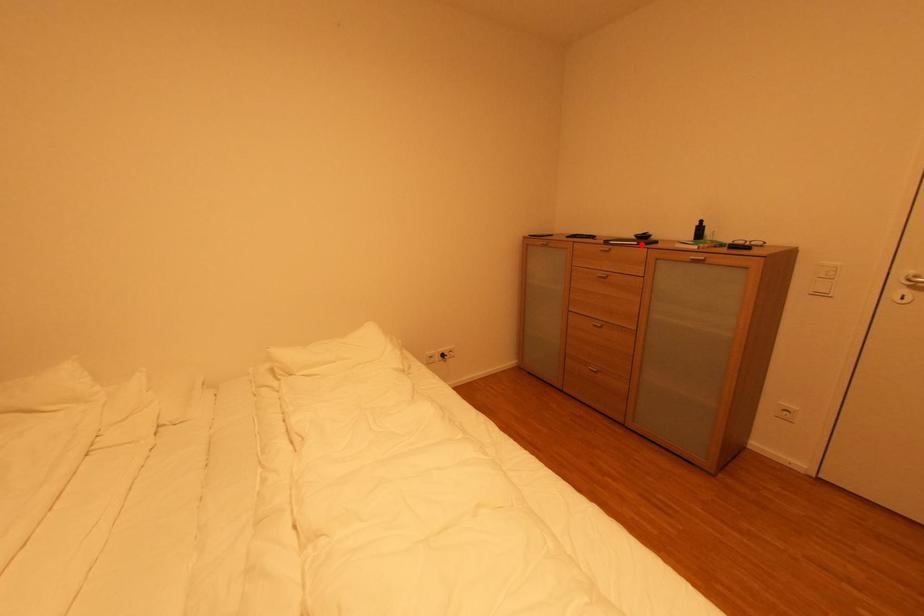
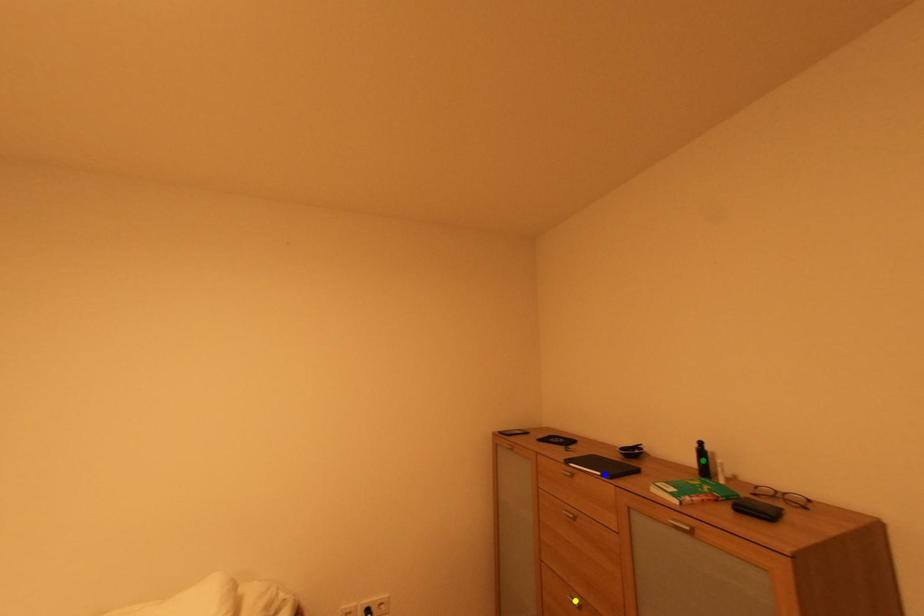
Question: I am providing you with two images of the same scene from different viewpoints. A red point is marked on the first image. You are given multiple points on the second image. In image 2, which mark is for the same physical point as the one in image 1?

Choices:
 (A) green point
 (B) yellow point
 (C) blue point

Answer: (C)